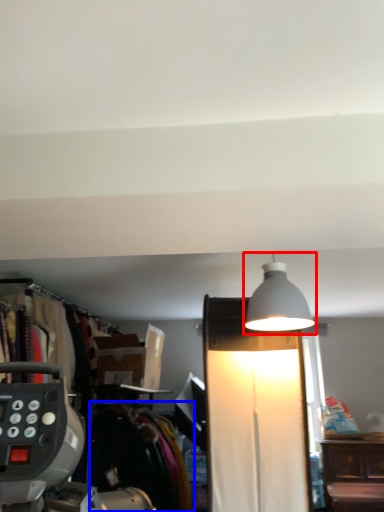
Question: Which object is further to the camera taking this photo, lamp (highlighted by a red box) or clothing (highlighted by a blue box)?

Choices:
 (A) lamp
 (B) clothing

Answer: (B)